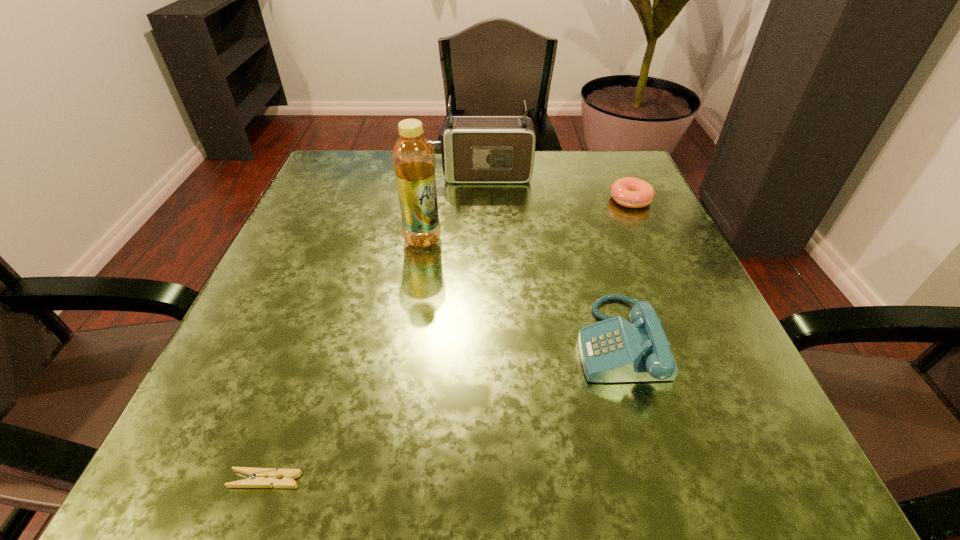
Where is `the tallest object`? the tallest object is located at coordinates (414, 163).

At what (x,y) coordinates should I click in order to perform the action: click on the third nearest object. Please return your answer as a coordinate pair (x, y). The width and height of the screenshot is (960, 540). Looking at the image, I should click on (414, 163).

Find the location of a particular element. the second tallest object is located at coordinates (475, 149).

Find the location of `the farthest object`. the farthest object is located at coordinates (475, 149).

The height and width of the screenshot is (540, 960). I want to click on the second object from right to left, so click(614, 350).

At what (x,y) coordinates should I click in order to perform the action: click on the third shortest object. Please return your answer as a coordinate pair (x, y). This screenshot has width=960, height=540. Looking at the image, I should click on (614, 350).

Find the location of `doughnut`. doughnut is located at coordinates (630, 192).

Find the location of `the rightmost object`. the rightmost object is located at coordinates (630, 192).

Image resolution: width=960 pixels, height=540 pixels. In order to click on clothespin in this screenshot , I will do `click(258, 477)`.

Where is `the leftmost object`? The image size is (960, 540). the leftmost object is located at coordinates tap(258, 477).